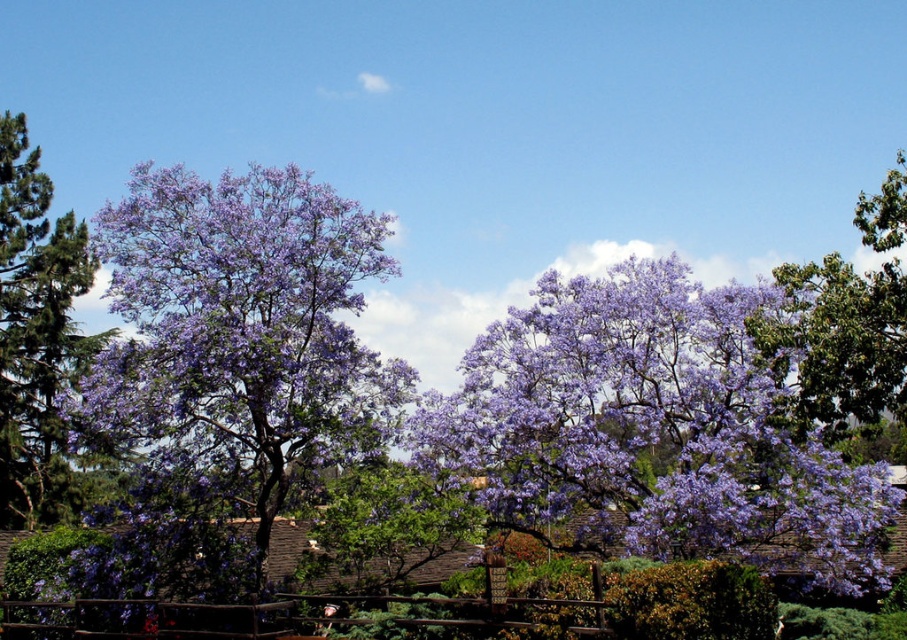
Question: Is purple matte flowers at center thinner than purple matte tree at left?

Choices:
 (A) no
 (B) yes

Answer: (A)

Question: Based on their relative distances, which object is nearer to the purple leafy tree at left?

Choices:
 (A) purple leafy tree at upper right
 (B) purple matte flowers at center

Answer: (B)

Question: Estimate the real-world distances between objects in this image. Which object is farther from the purple matte flowers at center?

Choices:
 (A) purple leafy tree at center
 (B) purple leafy tree at left
 (C) purple matte tree at left
 (D) purple leafy tree at upper right

Answer: (C)

Question: Observing the image, what is the correct spatial positioning of purple leafy tree at upper right in reference to purple leafy tree at center?

Choices:
 (A) right
 (B) left

Answer: (A)

Question: Considering the relative positions of purple matte flowers at center and purple matte tree at left in the image provided, where is purple matte flowers at center located with respect to purple matte tree at left?

Choices:
 (A) left
 (B) right

Answer: (B)

Question: Considering the real-world distances, which object is closest to the purple matte flowers at center?

Choices:
 (A) purple matte tree at left
 (B) purple leafy tree at left

Answer: (B)